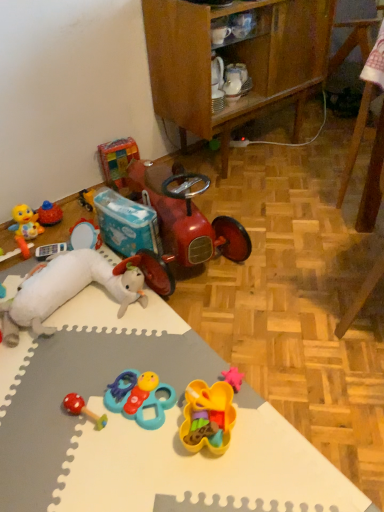
Find the location of a particular element. vacant space that is to the left of teal plastic toy at center, the third toy in the bottom-to-top sequence is located at coordinates (66, 411).